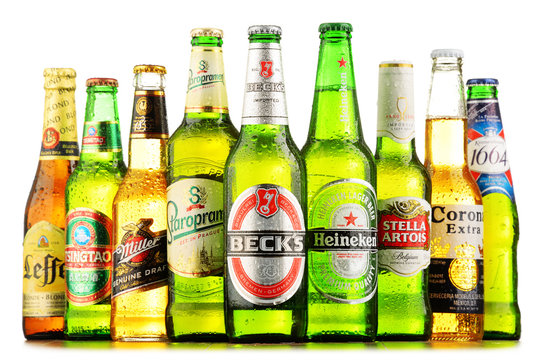
Where is `bottles`? Image resolution: width=539 pixels, height=360 pixels. bottles is located at coordinates (50, 226), (96, 226), (137, 227), (190, 228), (251, 225), (338, 229), (398, 227), (443, 231), (497, 237).